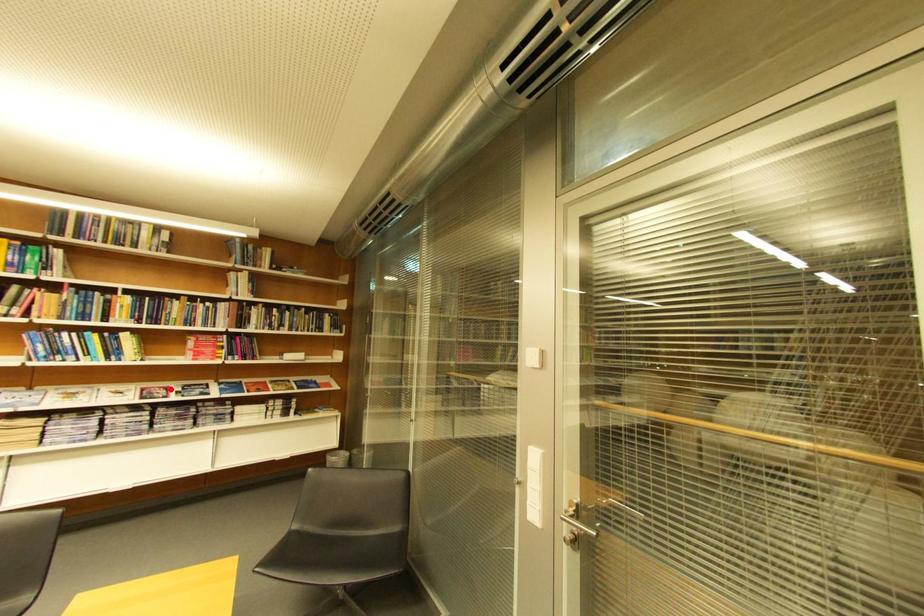
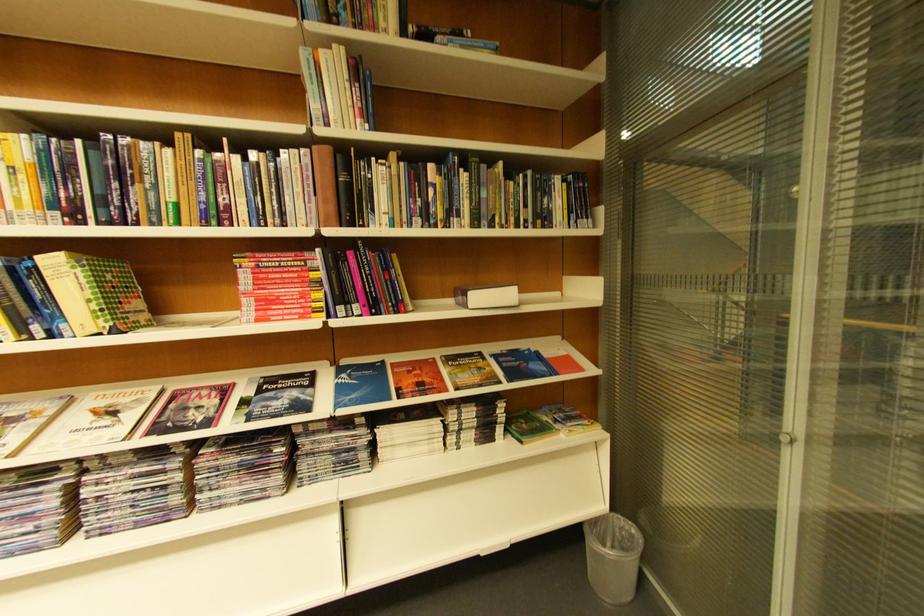
Find the pixel in the second image that matches the highlighted location in the first image.

(224, 389)